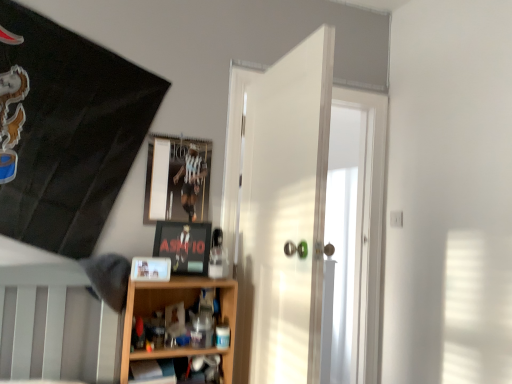
Describe the element at coordinates (151, 269) in the screenshot. I see `matte plastic picture frame at center, which is the 1th picture frame from front to back` at that location.

In order to face wooden shelf at lower center, which ranks as the first shelf in top-to-bottom order, should I rotate leftwards or rightwards?

Rotate your view left by about 10.415°.

Describe the element at coordinates (185, 306) in the screenshot. I see `wooden shelf at lower center, which ranks as the first shelf in top-to-bottom order` at that location.

What do you see at coordinates (177, 179) in the screenshot?
I see `metallic reflective frame at upper center, marked as the 3th picture frame in a bottom-to-top arrangement` at bounding box center [177, 179].

I want to click on metallic reflective frame at upper center, which appears as the 1th picture frame when viewed from the top, so click(177, 179).

Measure the distance between point (174, 381) and camera.

Point (174, 381) is 1.78 meters away from camera.

Based on the photo, what is the approximate width of white glossy door at center?

It is 31.63 inches.

Describe the element at coordinates (184, 246) in the screenshot. I see `matte black picture frame at center, which is the 2th picture frame in front-to-back order` at that location.

Image resolution: width=512 pixels, height=384 pixels. Identify the location of matte plastic picture frame at center, placed as the 3th picture frame when sorted from back to front. (151, 269).

From the picture: Could you tell me if wooden shelf at lower center, the 2th shelf when ordered from bottom to top, is turned towards metallic reflective frame at upper center, which appears as the 1th picture frame when viewed from the top?

No.

Is wooden shelf at lower center, which ranks as the first shelf in top-to-bottom order, directly adjacent to metallic reflective frame at upper center, which is the first picture frame from back to front?

No, wooden shelf at lower center, which ranks as the first shelf in top-to-bottom order, is not next to metallic reflective frame at upper center, which is the first picture frame from back to front.

Does point (151, 313) come closer to viewer compared to point (189, 214)?

Yes, it is.

Is wooden shelf at lower center, the 2th shelf when ordered from bottom to top, to the right of metallic reflective frame at upper center, marked as the 3th picture frame in a bottom-to-top arrangement, from the viewer's perspective?

Yes.

From a real-world perspective, is wooden shelf at lower center, which is counted as the second shelf, starting from the top, beneath wooden shelf at lower center, which ranks as the first shelf in top-to-bottom order?

Yes.

Does point (138, 379) appear closer or farther from the camera than point (135, 294)?

Point (138, 379) appears to be closer to the viewer than point (135, 294).

Consider the image. Considering the relative positions of wooden shelf at lower center, the 1th shelf ordered from the bottom, and wooden shelf at lower center, the 2th shelf when ordered from bottom to top, in the image provided, is wooden shelf at lower center, the 1th shelf ordered from the bottom, in front of wooden shelf at lower center, the 2th shelf when ordered from bottom to top,?

Yes, the depth of wooden shelf at lower center, the 1th shelf ordered from the bottom, is less than that of wooden shelf at lower center, the 2th shelf when ordered from bottom to top.

Would you say metallic reflective frame at upper center, marked as the 3th picture frame in a bottom-to-top arrangement, is a long distance from wooden shelf at lower center, which ranks as the first shelf in top-to-bottom order?

No, metallic reflective frame at upper center, marked as the 3th picture frame in a bottom-to-top arrangement, is not far from wooden shelf at lower center, which ranks as the first shelf in top-to-bottom order.

Which is correct: metallic reflective frame at upper center, marked as the 3th picture frame in a bottom-to-top arrangement, is inside wooden shelf at lower center, the 2th shelf when ordered from bottom to top, or outside of it?

metallic reflective frame at upper center, marked as the 3th picture frame in a bottom-to-top arrangement, lies outside wooden shelf at lower center, the 2th shelf when ordered from bottom to top.

Is metallic reflective frame at upper center, which appears as the 1th picture frame when viewed from the top, positioned with its back to wooden shelf at lower center, the 2th shelf when ordered from bottom to top?

No, metallic reflective frame at upper center, which appears as the 1th picture frame when viewed from the top,'s orientation is not away from wooden shelf at lower center, the 2th shelf when ordered from bottom to top.

Considering the relative sizes of metallic reflective frame at upper center, marked as the 3th picture frame in a bottom-to-top arrangement, and wooden shelf at lower center, the 2th shelf when ordered from bottom to top, in the image provided, is metallic reflective frame at upper center, marked as the 3th picture frame in a bottom-to-top arrangement, wider than wooden shelf at lower center, the 2th shelf when ordered from bottom to top,?

In fact, metallic reflective frame at upper center, marked as the 3th picture frame in a bottom-to-top arrangement, might be narrower than wooden shelf at lower center, the 2th shelf when ordered from bottom to top.

Is point (187, 176) positioned after point (199, 224)?

Yes, point (187, 176) is behind point (199, 224).

Is metallic reflective frame at upper center, which appears as the 1th picture frame when viewed from the top, next to matte black picture frame at center, placed as the 2th picture frame when sorted from bottom to top?

No, metallic reflective frame at upper center, which appears as the 1th picture frame when viewed from the top, is not in contact with matte black picture frame at center, placed as the 2th picture frame when sorted from bottom to top.

Considering the sizes of objects metallic reflective frame at upper center, marked as the 3th picture frame in a bottom-to-top arrangement, and matte black picture frame at center, placed as the 2th picture frame when sorted from bottom to top, in the image provided, who is taller, metallic reflective frame at upper center, marked as the 3th picture frame in a bottom-to-top arrangement, or matte black picture frame at center, placed as the 2th picture frame when sorted from bottom to top,?

With more height is metallic reflective frame at upper center, marked as the 3th picture frame in a bottom-to-top arrangement.

Choose the correct answer: Is metallic reflective frame at upper center, marked as the 3th picture frame in a bottom-to-top arrangement, inside matte black picture frame at center, marked as the second picture frame in a back-to-front arrangement, or outside it?

metallic reflective frame at upper center, marked as the 3th picture frame in a bottom-to-top arrangement, lies outside matte black picture frame at center, marked as the second picture frame in a back-to-front arrangement.

Does wooden shelf at lower center, which is counted as the second shelf, starting from the top, have a lesser width compared to matte black picture frame at center, which is the 2th picture frame in front-to-back order?

No, wooden shelf at lower center, which is counted as the second shelf, starting from the top, is not thinner than matte black picture frame at center, which is the 2th picture frame in front-to-back order.

Does wooden shelf at lower center, which is counted as the second shelf, starting from the top, have a larger size compared to matte black picture frame at center, which ranks as the 2th picture frame in top-to-bottom order?

Indeed, wooden shelf at lower center, which is counted as the second shelf, starting from the top, has a larger size compared to matte black picture frame at center, which ranks as the 2th picture frame in top-to-bottom order.

Is wooden shelf at lower center, the 1th shelf ordered from the bottom, inside or outside of matte black picture frame at center, which is the 2th picture frame in front-to-back order?

The correct answer is: outside.

Considering the positions of objects white glossy door at center and wooden shelf at lower center, the 2th shelf when ordered from bottom to top, in the image provided, who is more to the left, white glossy door at center or wooden shelf at lower center, the 2th shelf when ordered from bottom to top,?

From the viewer's perspective, wooden shelf at lower center, the 2th shelf when ordered from bottom to top, appears more on the left side.

Is white glossy door at center far from wooden shelf at lower center, the 2th shelf when ordered from bottom to top?

white glossy door at center is near wooden shelf at lower center, the 2th shelf when ordered from bottom to top, not far away.

From the image's perspective, is white glossy door at center located above or below wooden shelf at lower center, which ranks as the first shelf in top-to-bottom order?

Clearly, from the image's perspective, white glossy door at center is above wooden shelf at lower center, which ranks as the first shelf in top-to-bottom order.

Is white glossy door at center smaller than wooden shelf at lower center, the 2th shelf when ordered from bottom to top?

Incorrect, white glossy door at center is not smaller in size than wooden shelf at lower center, the 2th shelf when ordered from bottom to top.

Is matte black picture frame at center, marked as the second picture frame in a back-to-front arrangement, bigger or smaller than wooden shelf at lower center, which is counted as the second shelf, starting from the top?

Considering their sizes, matte black picture frame at center, marked as the second picture frame in a back-to-front arrangement, takes up less space than wooden shelf at lower center, which is counted as the second shelf, starting from the top.

Can wooden shelf at lower center, the 1th shelf ordered from the bottom, be found inside matte black picture frame at center, which is the 2th picture frame in front-to-back order?

No, wooden shelf at lower center, the 1th shelf ordered from the bottom, is located outside of matte black picture frame at center, which is the 2th picture frame in front-to-back order.

Who is taller, matte black picture frame at center, placed as the 2th picture frame when sorted from bottom to top, or wooden shelf at lower center, the 1th shelf ordered from the bottom?

Standing taller between the two is matte black picture frame at center, placed as the 2th picture frame when sorted from bottom to top.

Which picture frame is the 2nd one when counting from the back of the wooden shelf at lower center, which is counted as the second shelf, starting from the top? Please provide its 2D coordinates.

[(184, 246)]

Which picture frame is the 1st one when counting from the left side of the wooden shelf at lower center, the 2th shelf when ordered from bottom to top? Please provide its 2D coordinates.

[(177, 179)]

What are the coordinates of `shelf above the wooden shelf at lower center, which is counted as the second shelf, starting from the top (from the image's perspective)` in the screenshot? It's located at (185, 306).

Looking at the image, which one is located further to matte plastic picture frame at center, which is the 1th picture frame from front to back, matte black picture frame at center, which is the 2th picture frame in front-to-back order, or metallic reflective frame at upper center, marked as the 3th picture frame in a bottom-to-top arrangement?

metallic reflective frame at upper center, marked as the 3th picture frame in a bottom-to-top arrangement, is positioned further to the anchor matte plastic picture frame at center, which is the 1th picture frame from front to back.

When comparing their distances from white glossy door at center, does matte plastic picture frame at center, placed as the 3th picture frame when sorted from back to front, or wooden shelf at lower center, the 1th shelf ordered from the bottom, seem further?

matte plastic picture frame at center, placed as the 3th picture frame when sorted from back to front, is positioned further to the anchor white glossy door at center.

Based on their spatial positions, is matte black picture frame at center, marked as the second picture frame in a back-to-front arrangement, or metallic reflective frame at upper center, which appears as the 1th picture frame when viewed from the top, closer to wooden shelf at lower center, the 1th shelf ordered from the bottom?

matte black picture frame at center, marked as the second picture frame in a back-to-front arrangement, is closer to wooden shelf at lower center, the 1th shelf ordered from the bottom.

Based on their spatial positions, is metallic reflective frame at upper center, marked as the 3th picture frame in a bottom-to-top arrangement, or matte plastic picture frame at center, which is counted as the first picture frame, starting from the bottom, further from wooden shelf at lower center, the 1th shelf ordered from the bottom?

The object further to wooden shelf at lower center, the 1th shelf ordered from the bottom, is metallic reflective frame at upper center, marked as the 3th picture frame in a bottom-to-top arrangement.

Looking at the image, which one is located further to wooden shelf at lower center, the 2th shelf when ordered from bottom to top, white glossy door at center or matte black picture frame at center, which ranks as the 2th picture frame in top-to-bottom order?

The object further to wooden shelf at lower center, the 2th shelf when ordered from bottom to top, is white glossy door at center.

When comparing their distances from wooden shelf at lower center, which ranks as the first shelf in top-to-bottom order, does metallic reflective frame at upper center, which is the first picture frame from back to front, or matte plastic picture frame at center, the 3th picture frame positioned from the top, seem further?

metallic reflective frame at upper center, which is the first picture frame from back to front, is further to wooden shelf at lower center, which ranks as the first shelf in top-to-bottom order.

Estimate the real-world distances between objects in this image. Which object is closer to matte plastic picture frame at center, the 3th picture frame positioned from the top, matte black picture frame at center, which is the 2th picture frame in front-to-back order, or wooden shelf at lower center, the 1th shelf ordered from the bottom?

matte black picture frame at center, which is the 2th picture frame in front-to-back order, lies closer to matte plastic picture frame at center, the 3th picture frame positioned from the top, than the other object.

Looking at the image, which one is located closer to white glossy door at center, matte plastic picture frame at center, the 3th picture frame positioned from the top, or wooden shelf at lower center, the 2th shelf when ordered from bottom to top?

Based on the image, wooden shelf at lower center, the 2th shelf when ordered from bottom to top, appears to be nearer to white glossy door at center.

This screenshot has height=384, width=512. I want to click on shelf between matte black picture frame at center, which ranks as the 2th picture frame in top-to-bottom order, and wooden shelf at lower center, the 1th shelf ordered from the bottom, in the vertical direction, so click(x=185, y=306).

Locate an element on the screen. Image resolution: width=512 pixels, height=384 pixels. door between metallic reflective frame at upper center, marked as the 3th picture frame in a bottom-to-top arrangement, and wooden shelf at lower center, the 1th shelf ordered from the bottom, vertically is located at coordinates (304, 216).

Locate an element on the screen. The image size is (512, 384). picture frame between white glossy door at center and matte black picture frame at center, which ranks as the 2th picture frame in top-to-bottom order, from front to back is located at coordinates (151, 269).

Identify the location of shelf that lies between matte plastic picture frame at center, placed as the 3th picture frame when sorted from back to front, and wooden shelf at lower center, which is counted as the second shelf, starting from the top, from top to bottom. (185, 306).